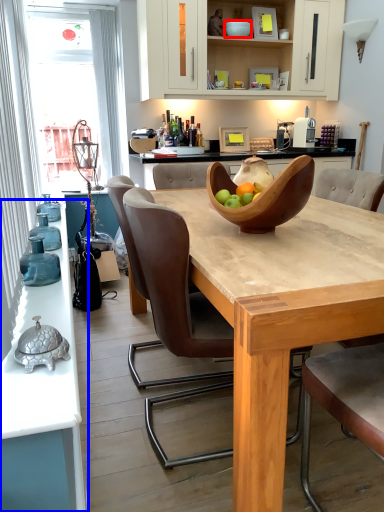
Question: Among these objects, which one is nearest to the camera, bowl (highlighted by a red box) or countertop (highlighted by a blue box)?

Choices:
 (A) bowl
 (B) countertop

Answer: (B)